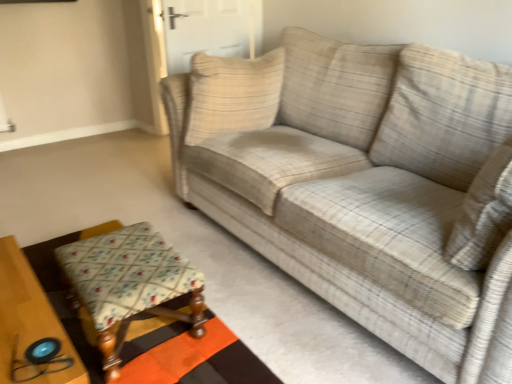
The image size is (512, 384). I want to click on vacant region to the right of floral fabric stool at lower left, so click(247, 316).